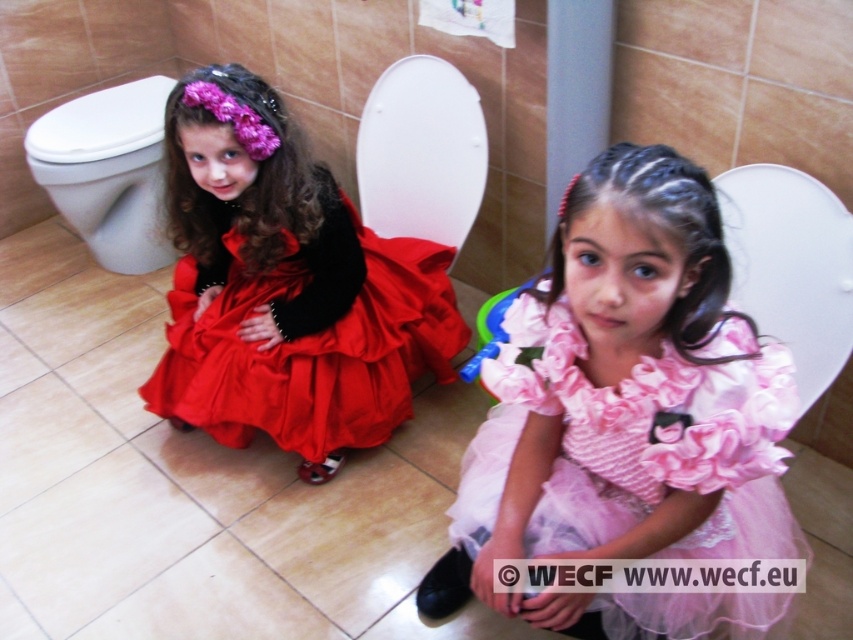
You are a tailor measuring for alterations. You see the pink satin dress at center and the white glossy toilet bowl at left. Which item is wider?

The pink satin dress at center is wider than the white glossy toilet bowl at left.

You are a photographer setting up a shoot in a bathroom. You need to position a camera to capture both the pink satin dress at center and the matte satin dress at left in the same frame. Based on their positions, which dress should be placed closer to the camera to ensure both are fully visible?

The pink satin dress at center is to the right of the matte satin dress at left. To ensure both are fully visible, the matte satin dress at left should be placed closer to the camera since it is positioned further away from the center, allowing the camera to capture both dresses within the frame.

You are a photographer setting up a shoot in a bathroom. You need to position a camera to capture both the pink satin dress at center and the matte satin dress at left. Based on their positions, which dress will appear lower in the photo?

The pink satin dress at center will appear lower in the photo because it is located below the matte satin dress at left.